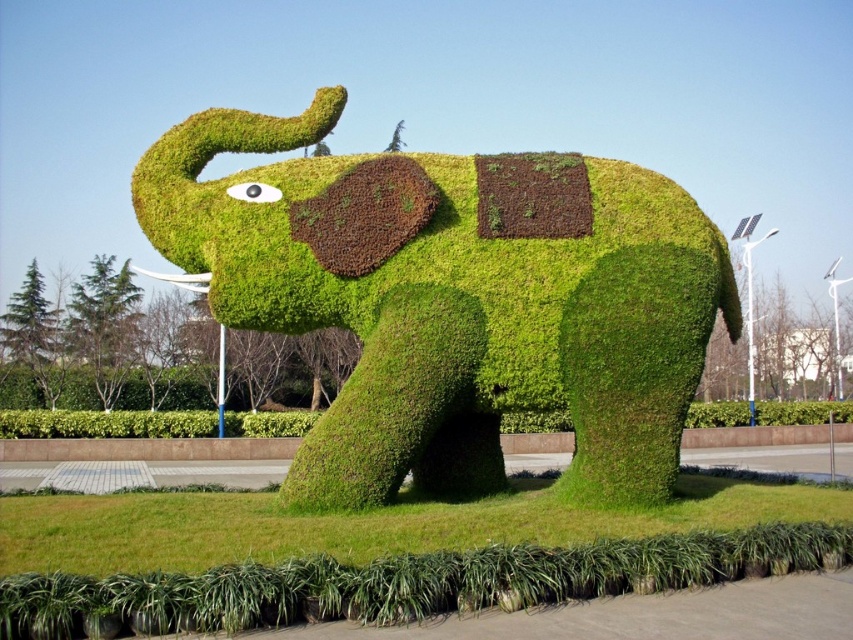
You are standing on the paved walkway and see the green grassy elephant at center and the green grass at lower center. Which object is located higher up in the image?

The green grassy elephant at center is positioned over the green grass at lower center, so it is higher up in the image.

You are a gardener who wants to mow the green grass at lower center. However, the green grassy elephant at center is in the way. Can you mow the grass behind the elephant without moving it?

The green grass at lower center is behind the green grassy elephant at center, so you can mow the grass behind the elephant without moving it.

You are a gardener planning to place a new decorative pot that is 2 meters wide between the green grassy elephant at center and the green grass at lower center. Given their widths, can the pot fit between them without overlapping either?

The green grassy elephant at center is wider than the green grass at lower center. Since the pot is 2 meters wide, it depends on the actual widths of both areas. However, the description only states the elephant is wider but doesn not provide exact measurements to confirm if the total space between them can accommodate the pot. More information is needed.